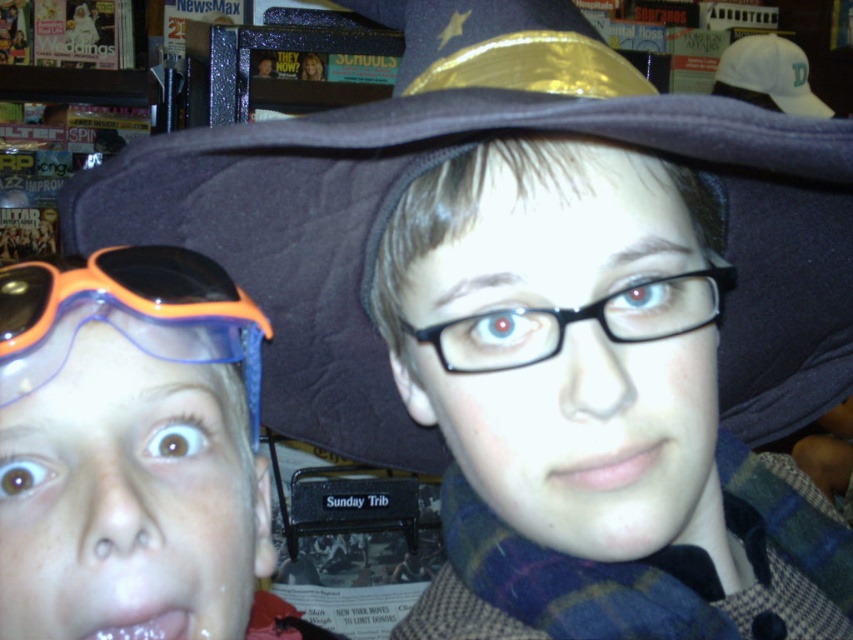
Question: Where is dark felt witch hat at upper center located in relation to black plastic glasses at center in the image?

Choices:
 (A) below
 (B) above

Answer: (B)

Question: In this image, where is dark felt witch hat at upper center located relative to black plastic glasses at center?

Choices:
 (A) below
 (B) above

Answer: (B)

Question: Is dark felt witch hat at upper center smaller than black plastic glasses at center?

Choices:
 (A) no
 (B) yes

Answer: (A)